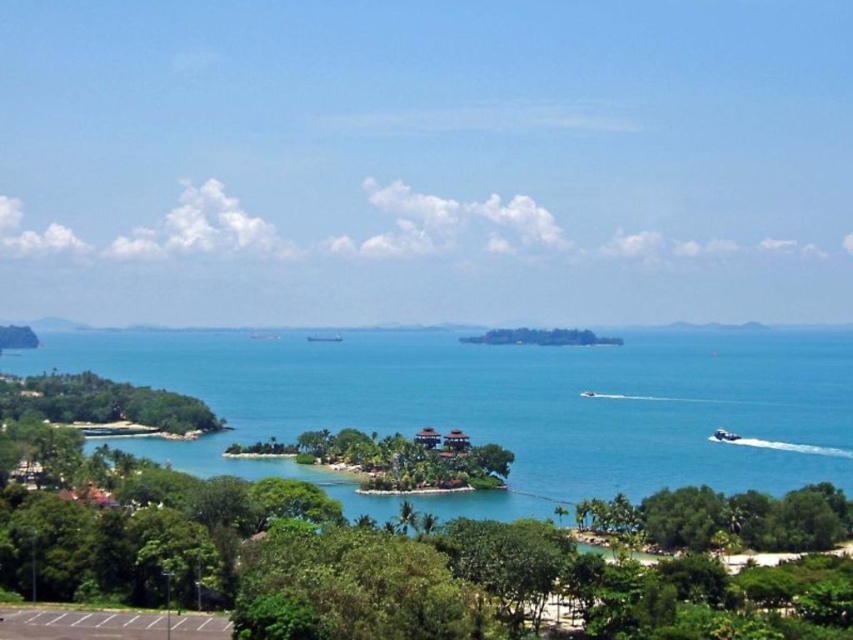
Question: Is the position of blue water at center less distant than that of white glossy boat at lower right?

Choices:
 (A) yes
 (B) no

Answer: (A)

Question: Does green leafy tree at lower left appear on the left side of white glossy boat at lower right?

Choices:
 (A) yes
 (B) no

Answer: (A)

Question: Is green leafy tree at lower right positioned in front of green leafy tree at center?

Choices:
 (A) yes
 (B) no

Answer: (A)

Question: Which object is positioned farthest from the blue water at center?

Choices:
 (A) green leafy tree at lower left
 (B) green leafy tree at lower right

Answer: (B)

Question: Which point is closer to the camera?

Choices:
 (A) (3, 413)
 (B) (200, 336)
 (C) (674, 518)

Answer: (C)

Question: Which point is farther to the camera?

Choices:
 (A) (807, 388)
 (B) (730, 496)

Answer: (A)